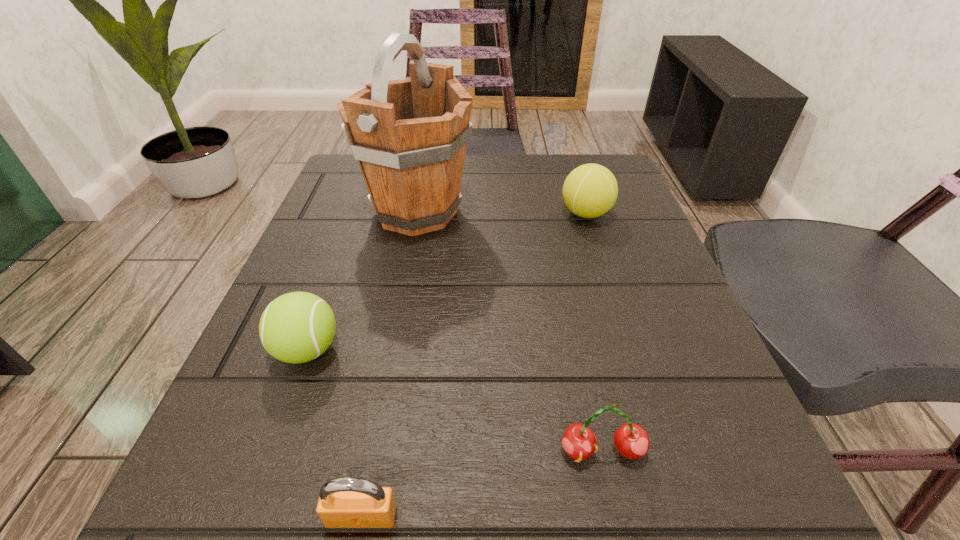
Where is `vacant space located with stems pointing upwards on the second nearest object`? vacant space located with stems pointing upwards on the second nearest object is located at coordinates (618, 526).

Identify the location of bucket that is at the far edge. (409, 136).

Locate an element on the screen. This screenshot has height=540, width=960. tennis ball that is positioned at the far edge is located at coordinates (590, 190).

Where is `cherry at the near edge`? The height and width of the screenshot is (540, 960). cherry at the near edge is located at coordinates (631, 440).

The width and height of the screenshot is (960, 540). I want to click on padlock that is positioned at the near edge, so click(x=346, y=502).

Identify the location of bucket that is at the left edge. The image size is (960, 540). (409, 136).

The height and width of the screenshot is (540, 960). Find the location of `tennis ball that is at the left edge`. tennis ball that is at the left edge is located at coordinates (297, 327).

Find the location of a particular element. tennis ball positioned at the right edge is located at coordinates (590, 190).

The height and width of the screenshot is (540, 960). I want to click on cherry that is at the right edge, so click(x=631, y=440).

Locate an element on the screen. This screenshot has width=960, height=540. object that is at the far left corner is located at coordinates (409, 136).